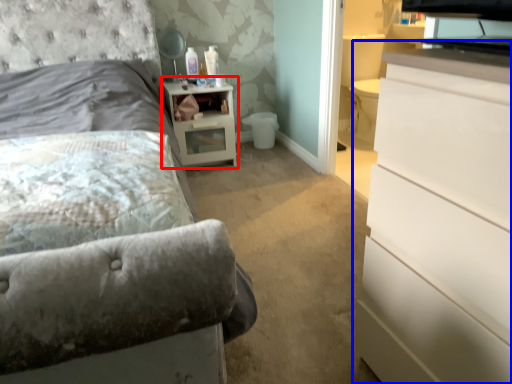
Question: Which point is further to the camera, nightstand (highlighted by a red box) or chest of drawers (highlighted by a blue box)?

Choices:
 (A) nightstand
 (B) chest of drawers

Answer: (A)